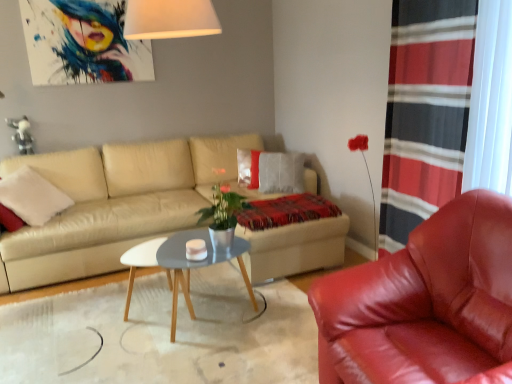
Question: From the image's perspective, would you say shiny red leather armchair at right is positioned over gray wooden coffee table at center?

Choices:
 (A) no
 (B) yes

Answer: (B)

Question: From a real-world perspective, does shiny red leather armchair at right sit lower than gray wooden coffee table at center?

Choices:
 (A) yes
 (B) no

Answer: (B)

Question: Considering the relative positions of shiny red leather armchair at right and gray wooden coffee table at center in the image provided, is shiny red leather armchair at right to the left of gray wooden coffee table at center from the viewer's perspective?

Choices:
 (A) yes
 (B) no

Answer: (B)

Question: Is shiny red leather armchair at right outside of gray wooden coffee table at center?

Choices:
 (A) yes
 (B) no

Answer: (A)

Question: Does shiny red leather armchair at right appear on the right side of gray wooden coffee table at center?

Choices:
 (A) yes
 (B) no

Answer: (A)

Question: From the image's perspective, relative to shiny red leather armchair at right, is beige leather couch at center above or below?

Choices:
 (A) below
 (B) above

Answer: (B)

Question: Considering the positions of point (103, 160) and point (441, 311), is point (103, 160) closer or farther from the camera than point (441, 311)?

Choices:
 (A) farther
 (B) closer

Answer: (A)

Question: Considering the positions of beige leather couch at center and shiny red leather armchair at right in the image, is beige leather couch at center taller or shorter than shiny red leather armchair at right?

Choices:
 (A) tall
 (B) short

Answer: (A)

Question: Considering the positions of beige leather couch at center and shiny red leather armchair at right in the image, is beige leather couch at center wider or thinner than shiny red leather armchair at right?

Choices:
 (A) thin
 (B) wide

Answer: (B)

Question: Is point (286, 198) closer or farther from the camera than point (179, 263)?

Choices:
 (A) farther
 (B) closer

Answer: (A)

Question: From a real-world perspective, relative to gray wooden coffee table at center, is plaid woolen blanket at center vertically above or below?

Choices:
 (A) below
 (B) above

Answer: (B)

Question: Visually, is plaid woolen blanket at center positioned to the left or to the right of gray wooden coffee table at center?

Choices:
 (A) left
 (B) right

Answer: (B)

Question: Choose the correct answer: Is plaid woolen blanket at center inside gray wooden coffee table at center or outside it?

Choices:
 (A) outside
 (B) inside

Answer: (A)

Question: Relative to beige leather couch at center, is red striped curtain at right in front or behind?

Choices:
 (A) behind
 (B) front

Answer: (B)

Question: Considering the positions of red striped curtain at right and beige leather couch at center in the image, is red striped curtain at right taller or shorter than beige leather couch at center?

Choices:
 (A) tall
 (B) short

Answer: (A)